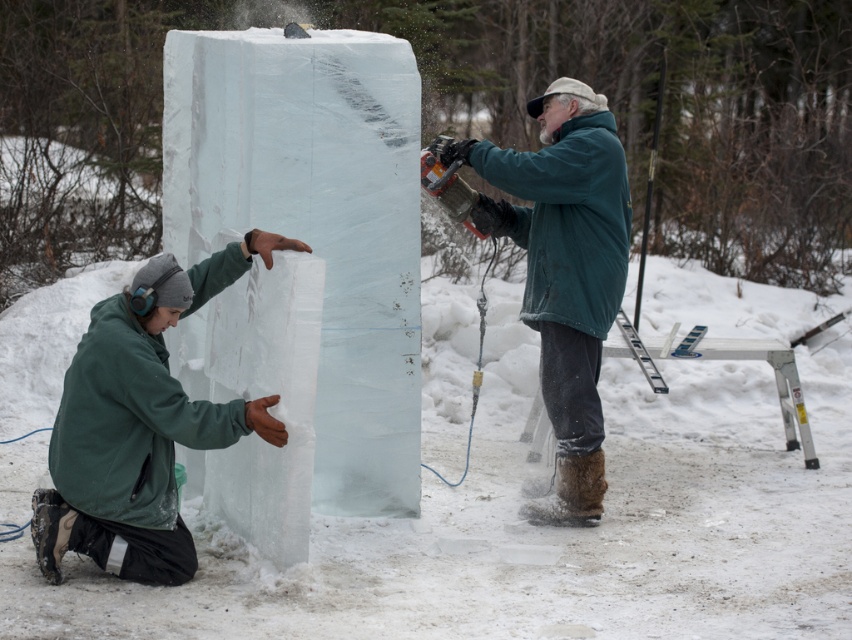
Consider the image. You are standing at the edge of the snowy clearing where the ice carving is taking place. You need to hand a tool to both the person in the green matte jacket at lower left and the person in the green matte jacket at center. Which jacket should you approach first to ensure you can reach them without moving past the other person?

You should approach the green matte jacket at lower left first because they are in front of the green matte jacket at center, making them more accessible without needing to move past the other person.